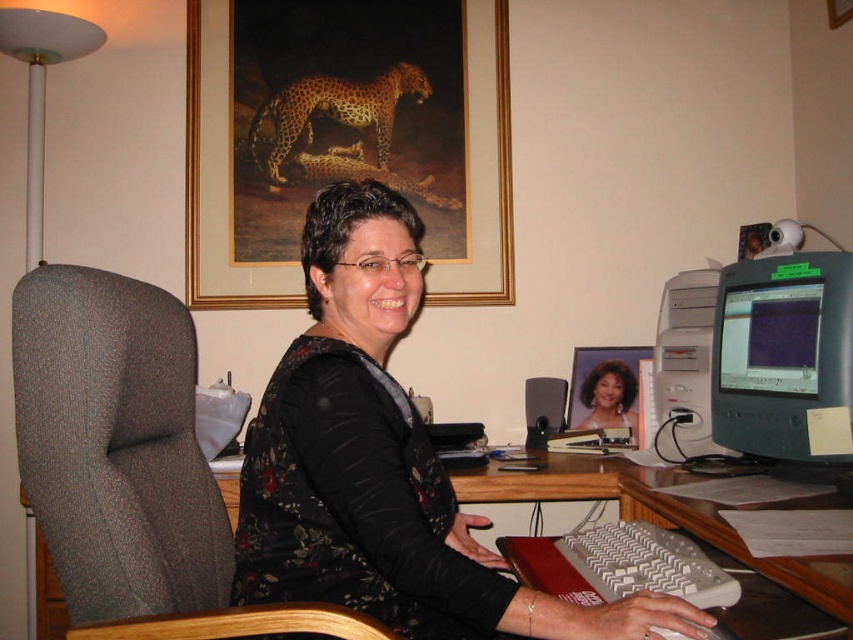
You are a delivery person who needs to place a package on the desk between the gray fabric swivel chair at left and the matte black monitor at right. Is there enough space between them to place the package?

The gray fabric swivel chair at left is to the left of the matte black monitor at right, so there is space between them to place the package.

You are organizing a meeting and need to ensure there is enough space for a visitor to sit next to the gray fabric swivel chair at left and the matte black monitor at right. Based on their sizes, can the visitor comfortably sit between them?

The gray fabric swivel chair at left is larger than the matte black monitor at right. Since the chair takes up more space, there may not be enough room for a visitor to comfortably sit between them. Consider rearranging the desk layout for better space utilization.

You are an interior designer analyzing the layout of this home office. The point at coordinates (345, 138) marks a specific object in the scene. Which object is located at this coordinate?

The point at coordinates (345, 138) indicates the gold framed picture at upper center.